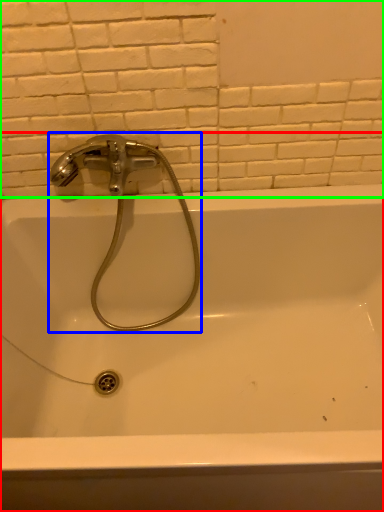
Question: Considering the real-world distances, which object is farthest from bathtub (highlighted by a red box)? tap (highlighted by a blue box) or ceramic tile (highlighted by a green box)?

Choices:
 (A) tap
 (B) ceramic tile

Answer: (B)